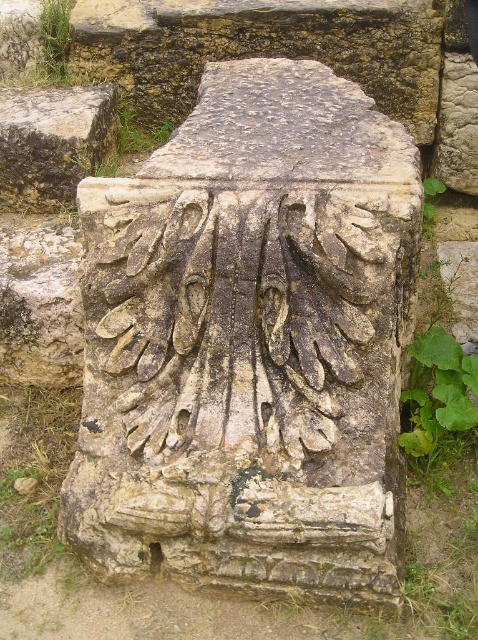
Question: Based on their relative distances, which object is nearer to the carved stone at upper left?

Choices:
 (A) carved stone column at center
 (B) carved stone at center

Answer: (A)

Question: Is carved stone at upper left thinner than carved stone at center?

Choices:
 (A) no
 (B) yes

Answer: (A)

Question: From the image, what is the correct spatial relationship of carved stone at upper right in relation to carved stone at center?

Choices:
 (A) left
 (B) right

Answer: (B)

Question: Estimate the real-world distances between objects in this image. Which object is farther from the carved stone at upper right?

Choices:
 (A) rough stone carving at center
 (B) carved stone at center
 (C) carved stone at upper left
 (D) carved stone column at center

Answer: (A)

Question: Which of the following is the closest to the observer?

Choices:
 (A) carved stone at upper right
 (B) rough stone carving at center
 (C) carved stone at center

Answer: (B)

Question: Is carved stone column at center below carved stone at upper left?

Choices:
 (A) no
 (B) yes

Answer: (B)